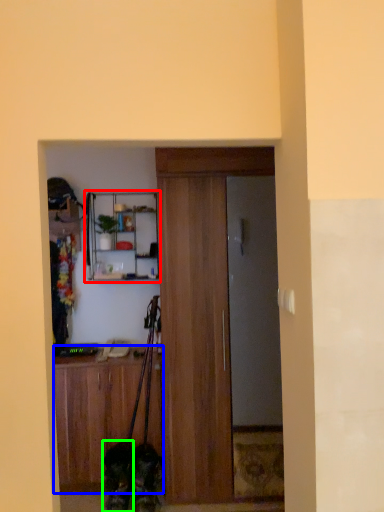
Question: Considering the real-world distances, which object is farthest from shelf (highlighted by a red box)? cabinetry (highlighted by a blue box) or dog (highlighted by a green box)?

Choices:
 (A) cabinetry
 (B) dog

Answer: (B)